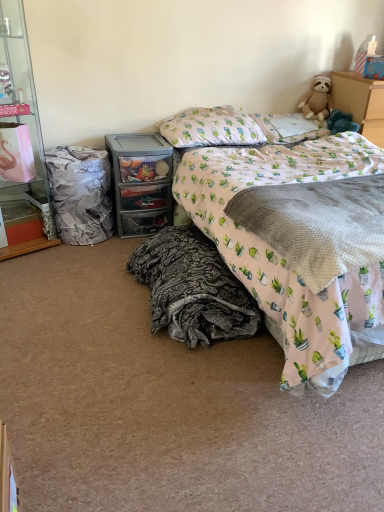
The image size is (384, 512). Identify the location of vacant area situated to the left side of dark gray textured blanket at lower center, which is the 1th blanket from left to right. (73, 300).